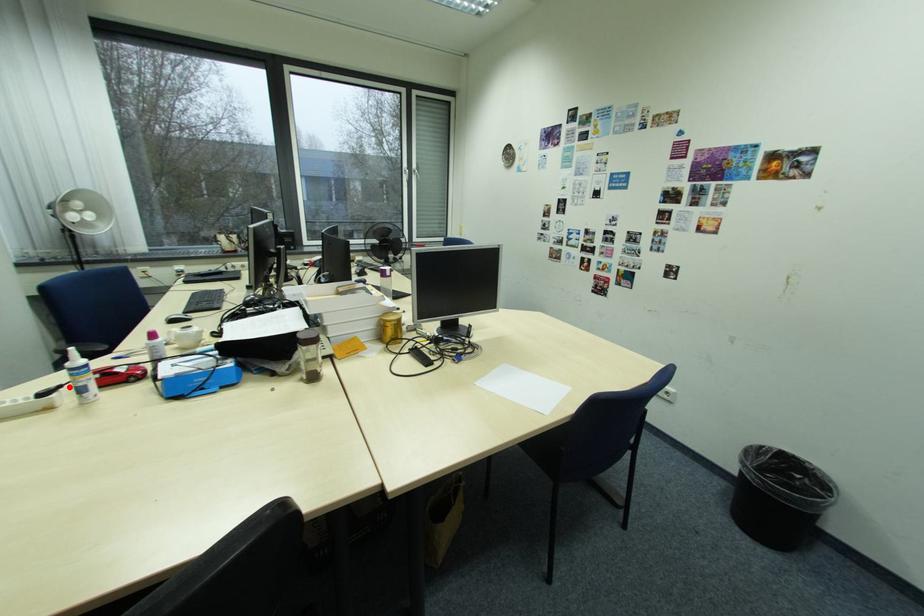
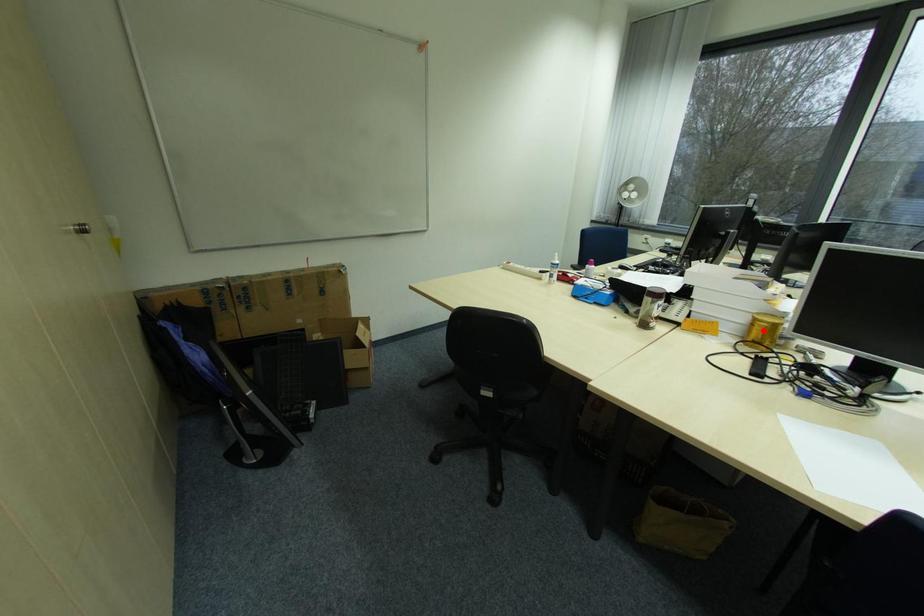
I am providing you with two images of the same scene from different viewpoints. A red point is marked on the first image and another point is marked on the second image. Are the points marked in image1 and image2 representing the same 3D position?

No